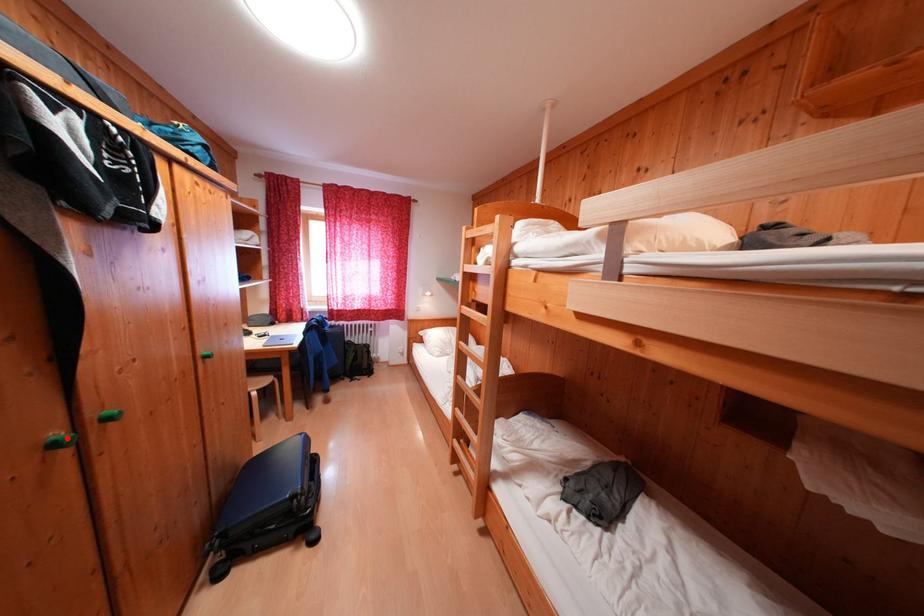
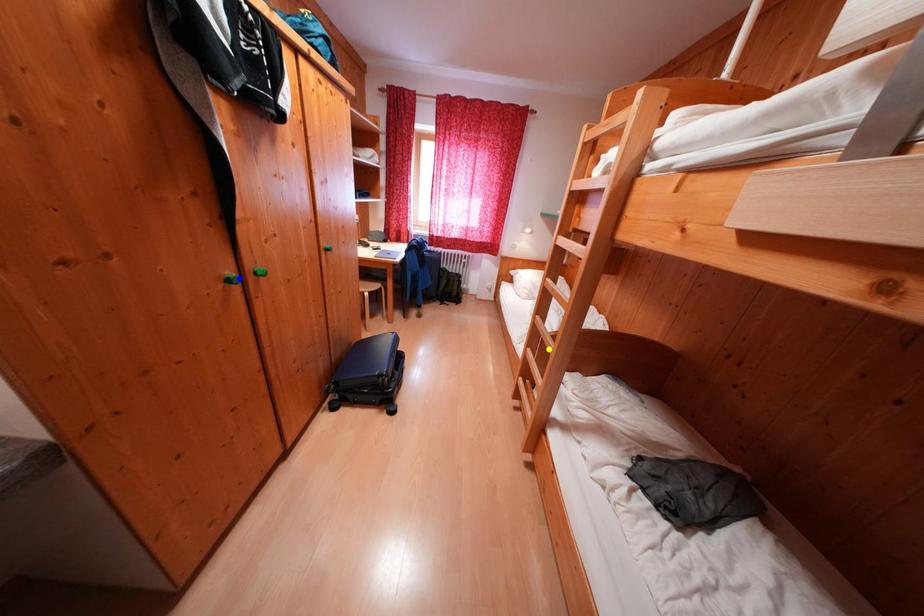
Question: I am providing you with two images of the same scene from different viewpoints. A red point is marked on the first image. You are given multiple points on the second image. In image 2, which mark is for the same physical point as the one in image 1?

Choices:
 (A) green point
 (B) yellow point
 (C) blue point

Answer: (C)